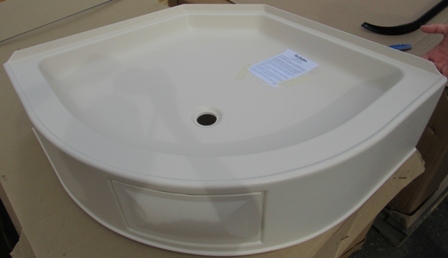
Find the location of a particular element. The height and width of the screenshot is (258, 448). left corner of shower pan is located at coordinates (50, 70).